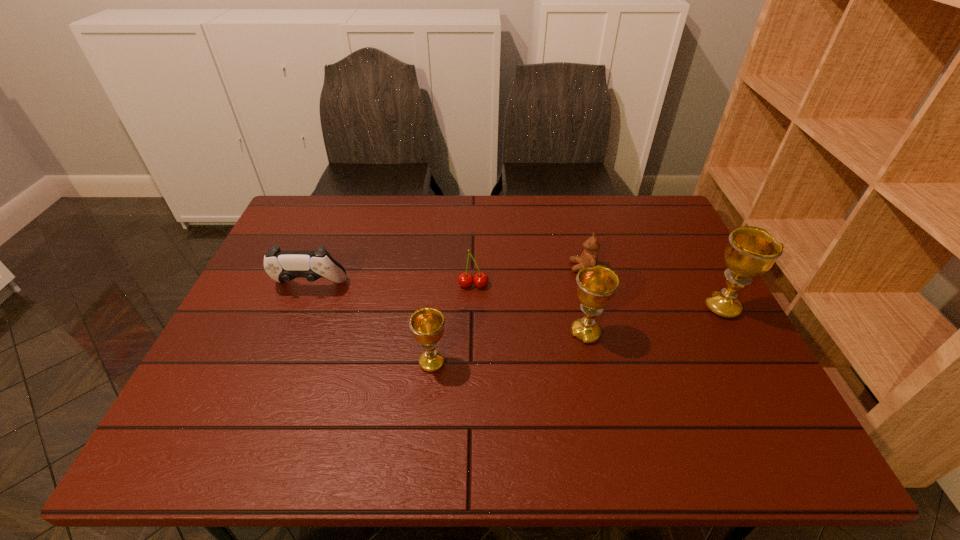
At what (x,y) coordinates should I click in order to perform the action: click on the leftmost chalice. Please return your answer as a coordinate pair (x, y). Looking at the image, I should click on (427, 324).

This screenshot has width=960, height=540. Find the location of `the nearest object`. the nearest object is located at coordinates (427, 324).

At what (x,y) coordinates should I click in order to perform the action: click on the second shortest chalice. Please return your answer as a coordinate pair (x, y). Image resolution: width=960 pixels, height=540 pixels. Looking at the image, I should click on (596, 287).

Identify the location of the second chalice from left to right. (596, 287).

Where is `the tallest chalice`? Image resolution: width=960 pixels, height=540 pixels. the tallest chalice is located at coordinates (751, 251).

Locate an element on the screen. The width and height of the screenshot is (960, 540). the tallest object is located at coordinates (751, 251).

In order to click on cherry in this screenshot , I will do `click(465, 279)`.

Locate an element on the screen. This screenshot has height=540, width=960. the leftmost object is located at coordinates (282, 266).

Where is `teddy bear`? The image size is (960, 540). teddy bear is located at coordinates (589, 258).

The height and width of the screenshot is (540, 960). What are the coordinates of `free region located 0.070m on the right of the nearest chalice` in the screenshot? It's located at (478, 362).